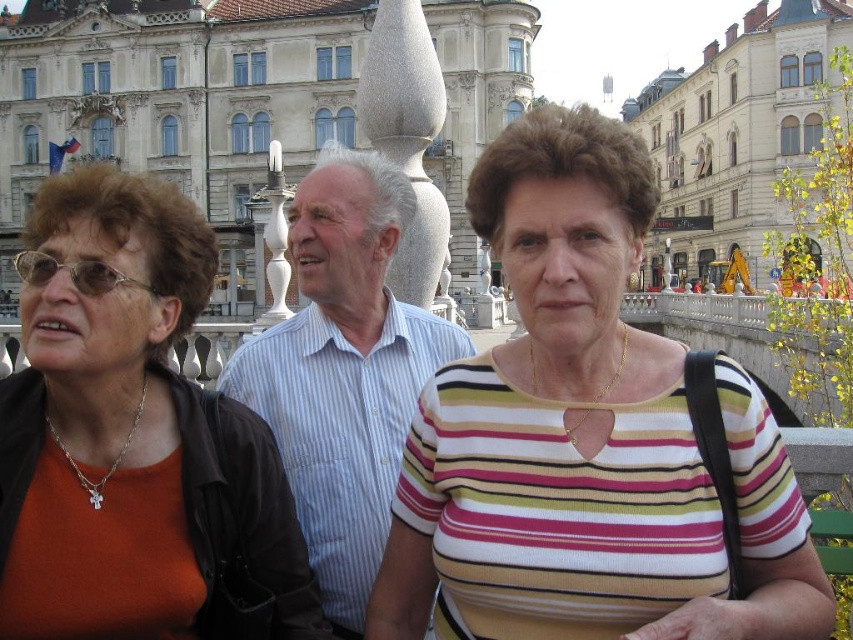
You are a photographer trying to capture a candid shot of the white striped shirt at center without including the matte black jacket at left in the frame. Is this possible given their positions?

The matte black jacket at left is in front of the white striped shirt at center, so it would block the view. Move to the side to avoid the matte black jacket at left.

You are standing at the viewer position in the scene. There is a point marked at coordinates point (460, 593). Can you reach that point by walking straight ahead without changing direction?

The distance between the viewer and point (460, 593) is 145.39 feet. Since there is no obstruction mentioned in the scene description, you can walk straight ahead to reach the point.